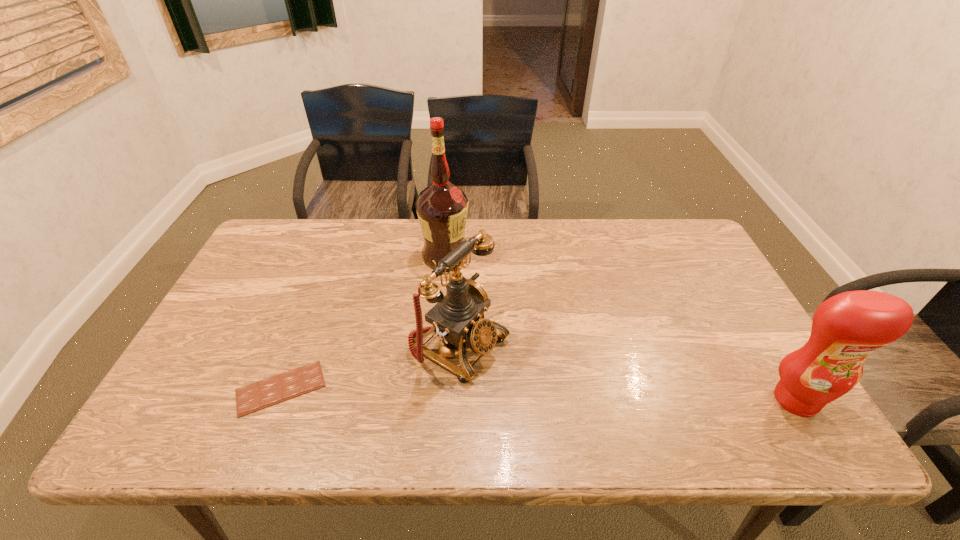
Locate an element on the screen. This screenshot has height=540, width=960. vacant space located 0.070m on the front of the telephone, featuring the rotary dial is located at coordinates (526, 381).

Locate an element on the screen. This screenshot has height=540, width=960. vacant space located on the front of the telephone, featuring the rotary dial is located at coordinates (548, 394).

Locate an element on the screen. This screenshot has height=540, width=960. vacant space situated on the front of the telephone, featuring the rotary dial is located at coordinates (552, 396).

This screenshot has height=540, width=960. Identify the location of object located in the far edge section of the desktop. (442, 208).

This screenshot has height=540, width=960. Find the location of `chocolate bar located in the near edge section of the desktop`. chocolate bar located in the near edge section of the desktop is located at coordinates (253, 397).

Where is `condiment that is at the near edge`? The height and width of the screenshot is (540, 960). condiment that is at the near edge is located at coordinates (846, 328).

Find the location of `telephone that is at the near edge`. telephone that is at the near edge is located at coordinates (458, 317).

This screenshot has width=960, height=540. In order to click on object positioned at the left edge in this screenshot , I will do tap(253, 397).

The image size is (960, 540). Identify the location of object present at the right edge. (846, 328).

Identify the location of object present at the near left corner. (253, 397).